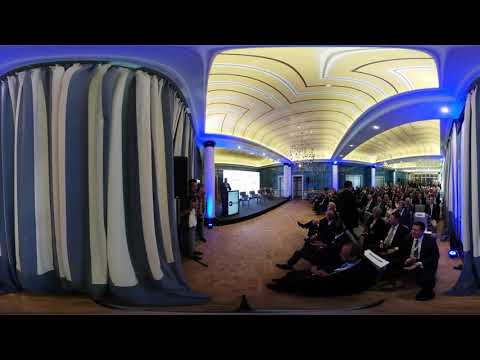
This screenshot has width=480, height=360. What are the coordinates of `stage` in the screenshot? It's located at (257, 210).